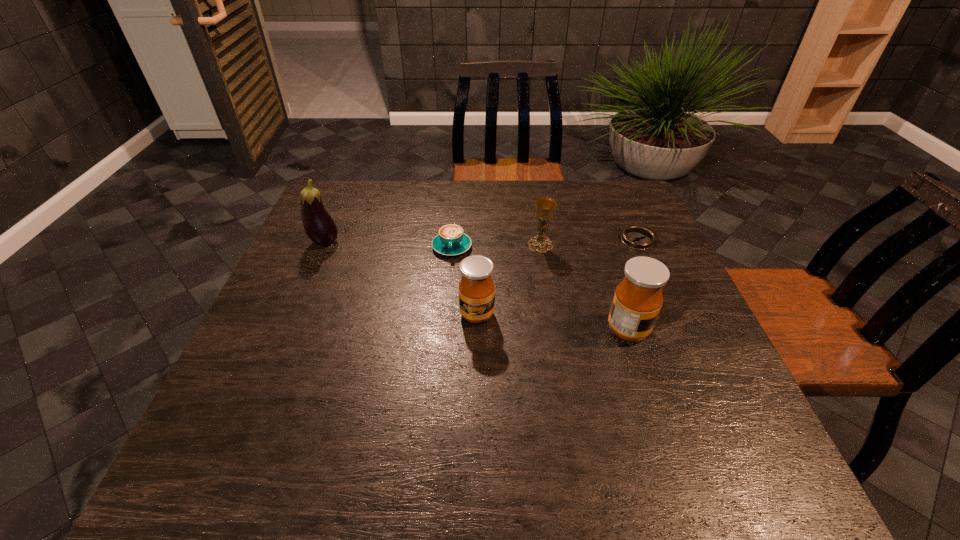
Where is `free region located 0.230m on the left of the compass`? This screenshot has width=960, height=540. free region located 0.230m on the left of the compass is located at coordinates (540, 240).

This screenshot has height=540, width=960. I want to click on vacant position located 0.210m on the right of the chalice, so click(x=628, y=245).

Where is `vacant space located with the handle on the right side of the cappuccino`? This screenshot has height=540, width=960. vacant space located with the handle on the right side of the cappuccino is located at coordinates (449, 280).

Identify the location of free spot located on the right of the leftmost object. (461, 242).

Locate an element on the screen. Image resolution: width=960 pixels, height=540 pixels. object positioned at the left edge is located at coordinates (319, 226).

In order to click on honey situated at the right edge in this screenshot , I will do coord(638,298).

Identify the location of compass present at the right edge. (639, 238).

The width and height of the screenshot is (960, 540). In the image, there is a desktop. What are the coordinates of `vacant region at the far edge` in the screenshot? It's located at (487, 197).

Image resolution: width=960 pixels, height=540 pixels. What are the coordinates of `vacant area at the near edge` in the screenshot? It's located at 512,429.

Locate an element on the screen. The height and width of the screenshot is (540, 960). free region at the left edge is located at coordinates (272, 373).